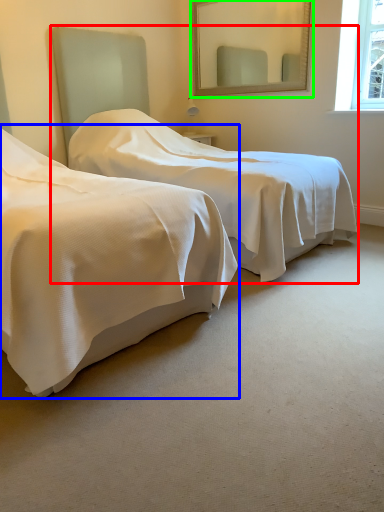
Question: Which object is the closest to the bed (highlighted by a red box)? Choose among these: bed (highlighted by a blue box) or mirror (highlighted by a green box).

Choices:
 (A) bed
 (B) mirror

Answer: (A)